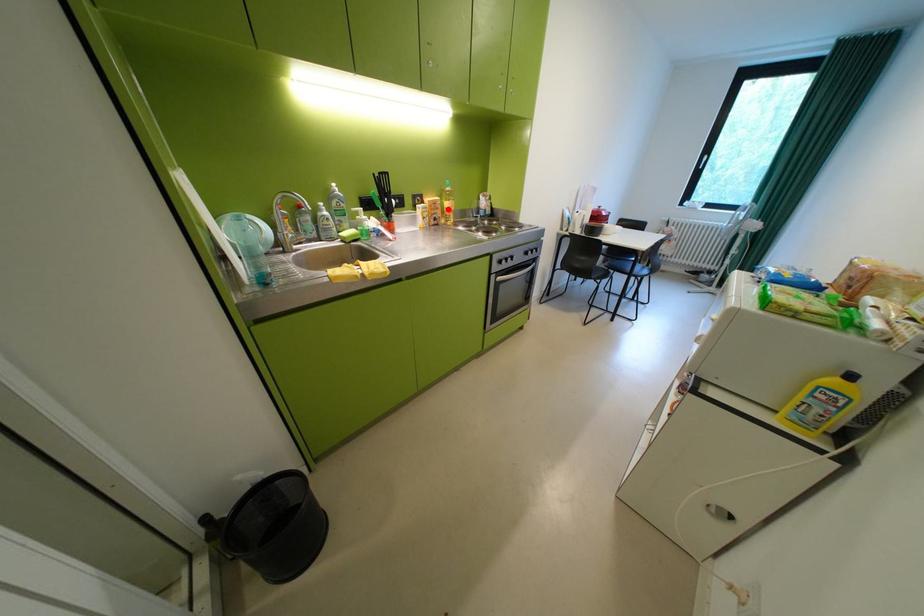
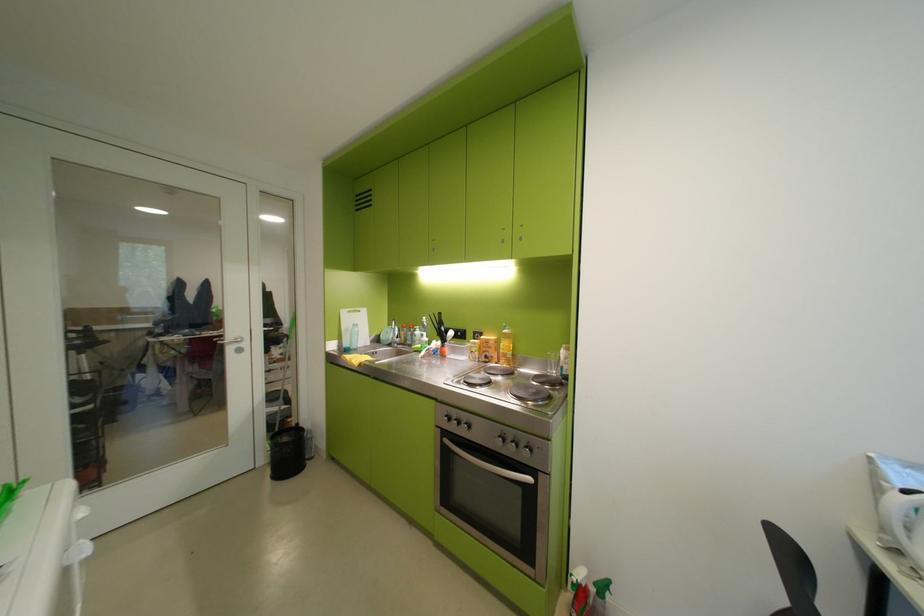
Question: I am providing you with two images of the same scene from different viewpoints. Image1 has a red point marked. In image2, the corresponding 3D location appears at what relative position? Reply with the corresponding letter.

Choices:
 (A) Closer
 (B) Farther

Answer: (B)